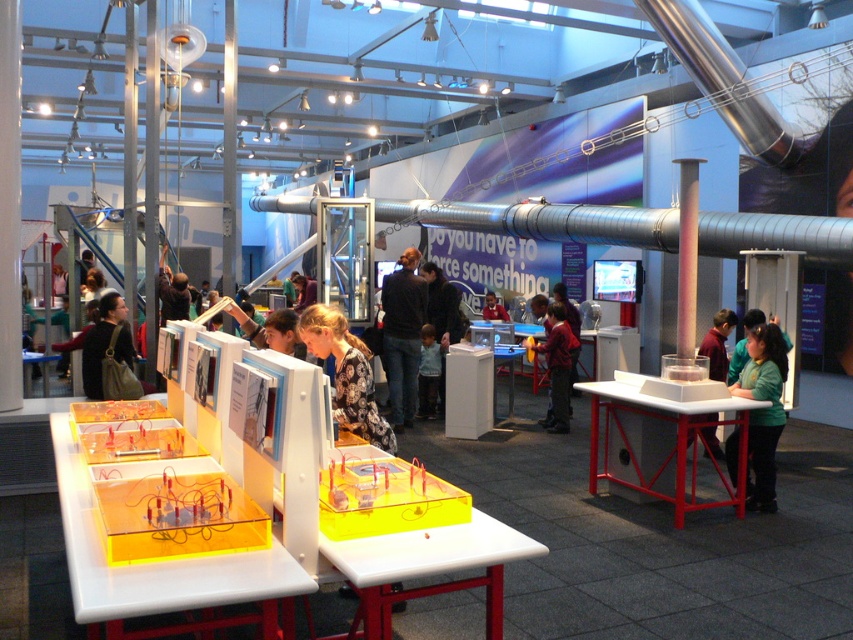
From the picture: Does matte black jacket at left appear over green fabric shirt at right?

Correct, matte black jacket at left is located above green fabric shirt at right.

Which is in front, point (85, 349) or point (700, 346)?

Positioned in front is point (85, 349).

From the picture: Who is more distant from viewer, (125,362) or (711,429)?

Point (711,429)

Image resolution: width=853 pixels, height=640 pixels. I want to click on matte black jacket at left, so click(102, 342).

Is translucent yellow plastic at center further to camera compared to red shirt at center?

No.

Is translucent yellow plastic at center below red shirt at center?

Yes, translucent yellow plastic at center is below red shirt at center.

Is point (107, 566) closer to camera compared to point (534, 348)?

Yes, point (107, 566) is in front of point (534, 348).

Find the location of a particular element. translucent yellow plastic at center is located at coordinates (154, 561).

Locate an element on the screen. The width and height of the screenshot is (853, 640). translucent yellow plastic at center is located at coordinates (154, 561).

Between translucent yellow plastic at center and floral-patterned shirt at center, which one has less height?

Standing shorter between the two is translucent yellow plastic at center.

Is point (267, 592) in front of point (337, 410)?

Yes, point (267, 592) is in front of point (337, 410).

Where is `translucent yellow plastic at center`? The width and height of the screenshot is (853, 640). translucent yellow plastic at center is located at coordinates (154, 561).